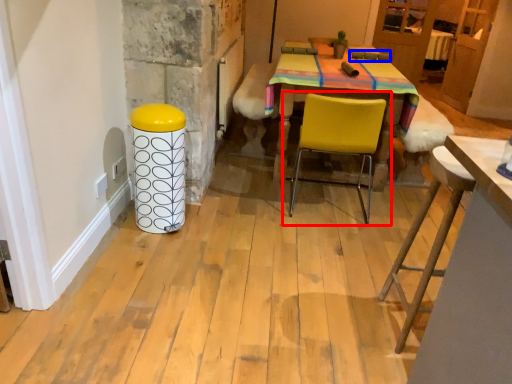
Question: Which object is closer to the camera taking this photo, chair (highlighted by a red box) or armchair (highlighted by a blue box)?

Choices:
 (A) chair
 (B) armchair

Answer: (A)